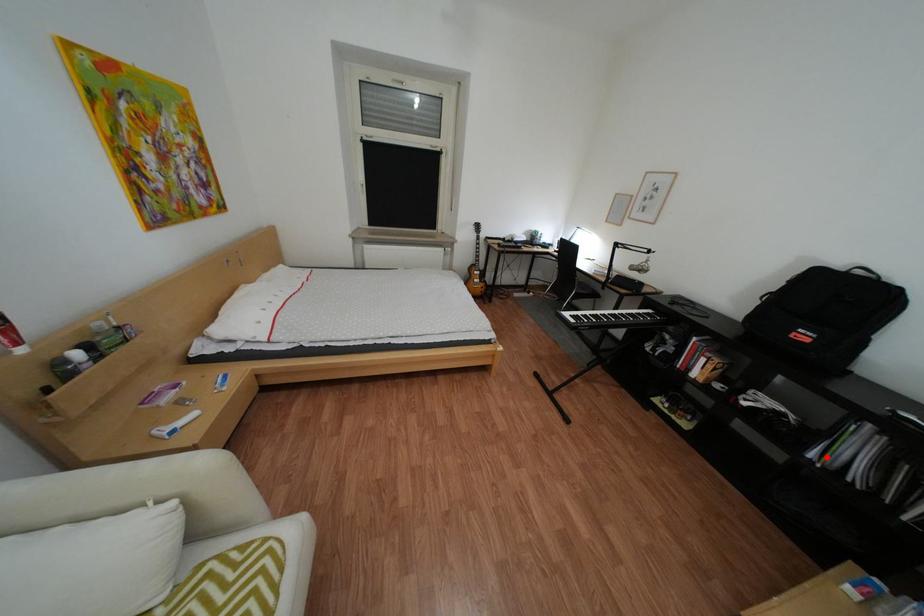
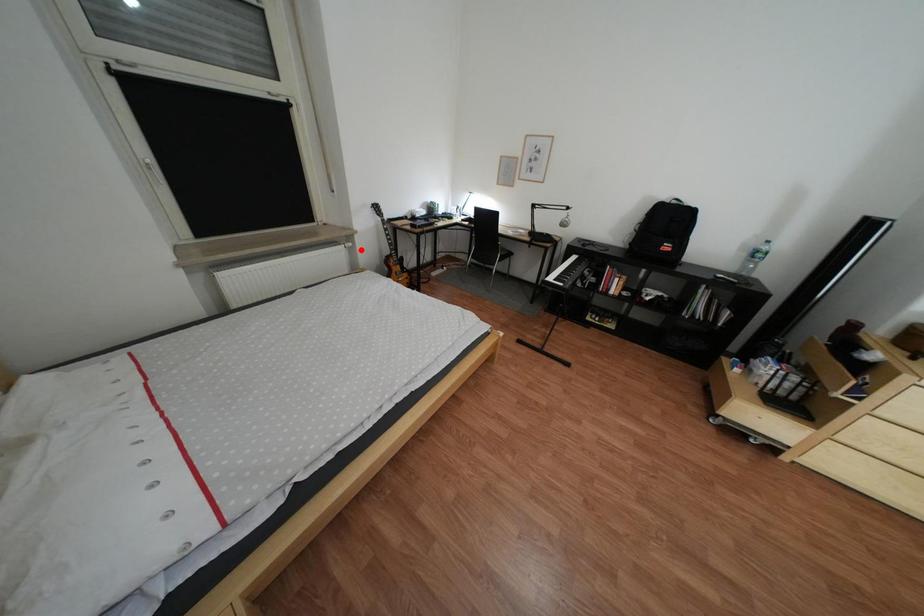
I am providing you with two images of the same scene from different viewpoints. A red point is marked on the first image and another point is marked on the second image. Do the highlighted points in image1 and image2 indicate the same real-world spot?

No